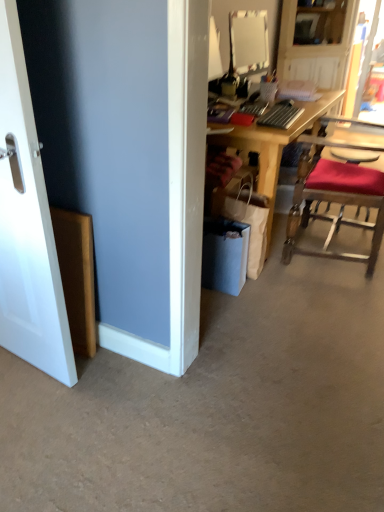
Question: From the image's perspective, is wooden desk at center on top of wooden chair with red cushion at right?

Choices:
 (A) no
 (B) yes

Answer: (B)

Question: Does wooden desk at center touch wooden chair with red cushion at right?

Choices:
 (A) yes
 (B) no

Answer: (B)

Question: Is wooden chair with red cushion at right inside wooden desk at center?

Choices:
 (A) yes
 (B) no

Answer: (B)

Question: Is wooden desk at center turned away from wooden chair with red cushion at right?

Choices:
 (A) yes
 (B) no

Answer: (B)

Question: Does wooden desk at center come behind wooden chair with red cushion at right?

Choices:
 (A) yes
 (B) no

Answer: (A)

Question: Considering the relative sizes of wooden desk at center and wooden chair with red cushion at right in the image provided, is wooden desk at center shorter than wooden chair with red cushion at right?

Choices:
 (A) no
 (B) yes

Answer: (B)

Question: From a real-world perspective, is wooden chair with red cushion at right positioned under wooden desk at center based on gravity?

Choices:
 (A) yes
 (B) no

Answer: (B)

Question: Can wooden desk at center be found inside wooden chair with red cushion at right?

Choices:
 (A) yes
 (B) no

Answer: (B)

Question: Can you confirm if wooden chair with red cushion at right is positioned to the right of wooden desk at center?

Choices:
 (A) no
 (B) yes

Answer: (B)

Question: Does wooden chair with red cushion at right appear on the left side of wooden desk at center?

Choices:
 (A) no
 (B) yes

Answer: (A)

Question: Is wooden chair with red cushion at right wider than wooden desk at center?

Choices:
 (A) yes
 (B) no

Answer: (B)

Question: Is wooden chair with red cushion at right positioned behind wooden desk at center?

Choices:
 (A) no
 (B) yes

Answer: (A)

Question: From the image's perspective, is gray carpet at lower center on white smooth door at left?

Choices:
 (A) yes
 (B) no

Answer: (B)